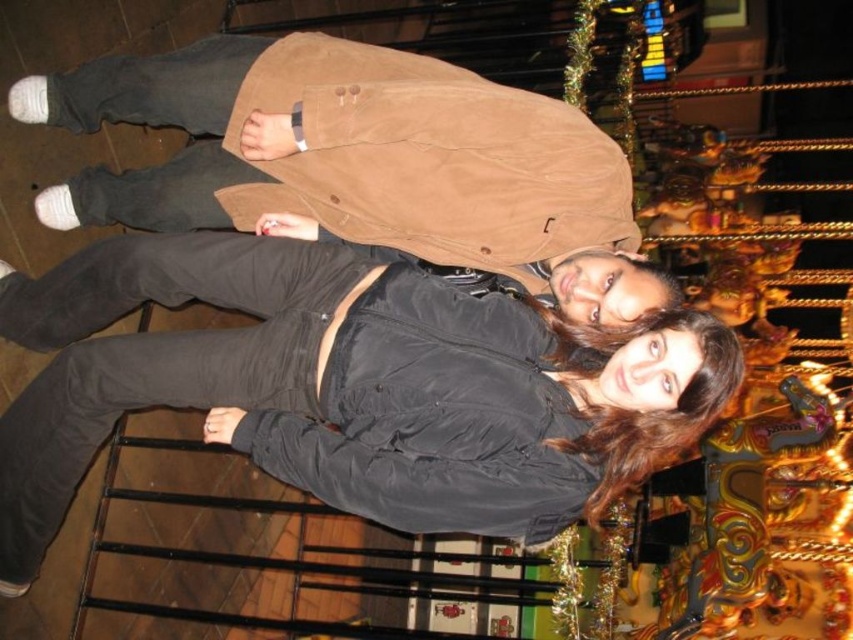
Question: Is matte black jacket at center above black matte jacket at center?

Choices:
 (A) no
 (B) yes

Answer: (A)

Question: Does matte black jacket at center appear on the right side of black matte jacket at center?

Choices:
 (A) no
 (B) yes

Answer: (A)

Question: Which object is closer to the camera taking this photo?

Choices:
 (A) black matte jacket at center
 (B) matte black jacket at center

Answer: (A)

Question: In this image, where is matte black jacket at center located relative to black matte jacket at center?

Choices:
 (A) right
 (B) left

Answer: (B)